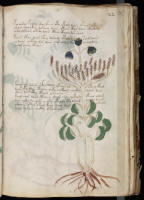
The image size is (144, 200). Find the location of `art`. art is located at coordinates (85, 123).